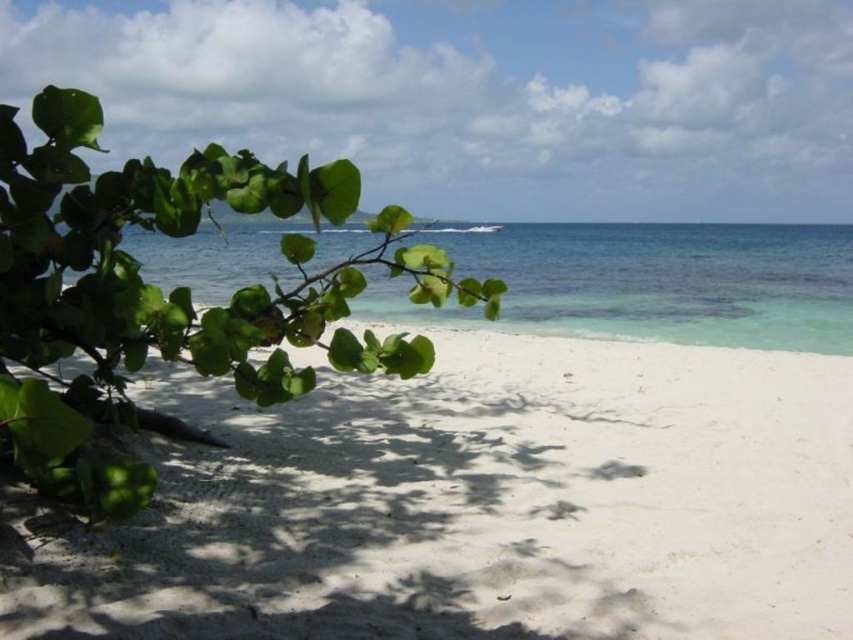
You are a photographer standing at the edge of the beach, holding a camera. You want to capture a closeup shot of the green leafy branch at left without any distortion. Since you know that the minimum focusing distance for your camera is 1.5 meters, will you be able to take the photo as planned?

The green leafy branch at left and the camera are 1.43 meters apart. Since the minimum focusing distance is 1.5 meters, the camera cannot focus properly at this distance. Therefore, you won t be able to take a clear closeup shot without distortion.

In the scene shown: You are standing at the point with coordinates point (809, 296) and want to walk to the point with coordinates point (341, 561). According to the scene description, will you be moving towards the ocean or away from it?

Since point (341, 561) is in front of point (809, 296), you are moving towards the ocean.

You are standing on the beach and see the green leafy branch at left and the white sandy beach at center. Which object is positioned to the right of the other?

The white sandy beach at center is to the right of the green leafy branch at left.